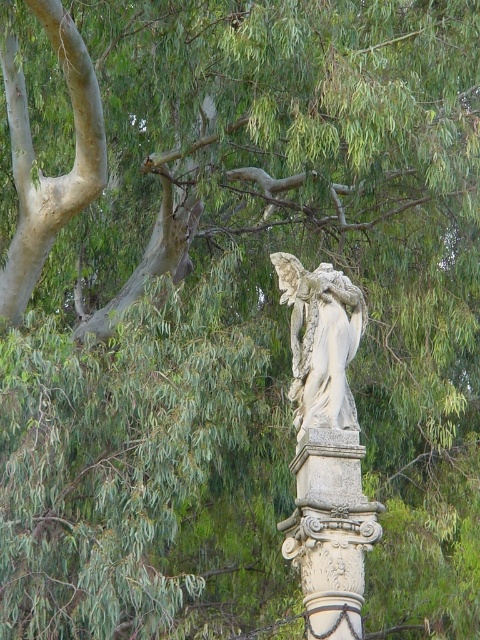
Is carved stone column at center to the right of white stone angel at center from the viewer's perspective?

Incorrect, carved stone column at center is not on the right side of white stone angel at center.

Is carved stone column at center smaller than white stone angel at center?

Indeed, carved stone column at center has a smaller size compared to white stone angel at center.

Between point (299, 493) and point (290, 291), which one is positioned in front?

Point (299, 493) is more forward.

The height and width of the screenshot is (640, 480). Identify the location of carved stone column at center. (331, 531).